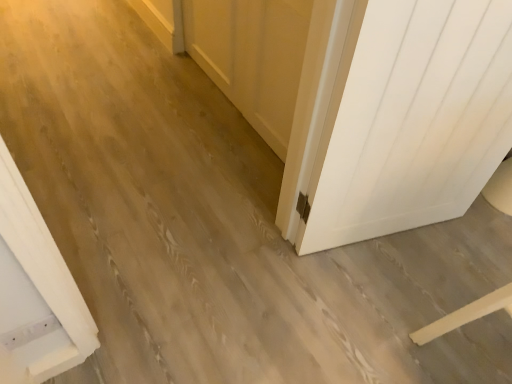
Question: Should I look upward or downward to see white wood barn door at center?

Choices:
 (A) down
 (B) up

Answer: (B)

Question: Is white wood barn door at center not close to white matte door at right?

Choices:
 (A) no
 (B) yes

Answer: (A)

Question: Is white wood barn door at center looking in the opposite direction of white matte door at right?

Choices:
 (A) no
 (B) yes

Answer: (A)

Question: Is white wood barn door at center not within white matte door at right?

Choices:
 (A) no
 (B) yes

Answer: (B)

Question: From a real-world perspective, is white wood barn door at center under white matte door at right?

Choices:
 (A) yes
 (B) no

Answer: (A)

Question: Is white wood barn door at center to the left of white matte door at right from the viewer's perspective?

Choices:
 (A) yes
 (B) no

Answer: (A)

Question: From the image's perspective, does white wood barn door at center appear higher than white matte door at right?

Choices:
 (A) yes
 (B) no

Answer: (A)

Question: Considering the relative positions of white matte door at right and white wood barn door at center in the image provided, is white matte door at right to the left of white wood barn door at center from the viewer's perspective?

Choices:
 (A) yes
 (B) no

Answer: (B)

Question: Does white matte door at right have a greater height compared to white wood barn door at center?

Choices:
 (A) yes
 (B) no

Answer: (A)

Question: Can you confirm if white matte door at right is thinner than white wood barn door at center?

Choices:
 (A) yes
 (B) no

Answer: (B)

Question: Is white matte door at right to the right of white wood barn door at center from the viewer's perspective?

Choices:
 (A) yes
 (B) no

Answer: (A)

Question: From the image's perspective, would you say white matte door at right is shown under white wood barn door at center?

Choices:
 (A) no
 (B) yes

Answer: (B)

Question: Is white matte door at right positioned before white wood barn door at center?

Choices:
 (A) no
 (B) yes

Answer: (B)

Question: Considering the positions of white matte door at right and white wood barn door at center in the image, is white matte door at right bigger or smaller than white wood barn door at center?

Choices:
 (A) big
 (B) small

Answer: (A)